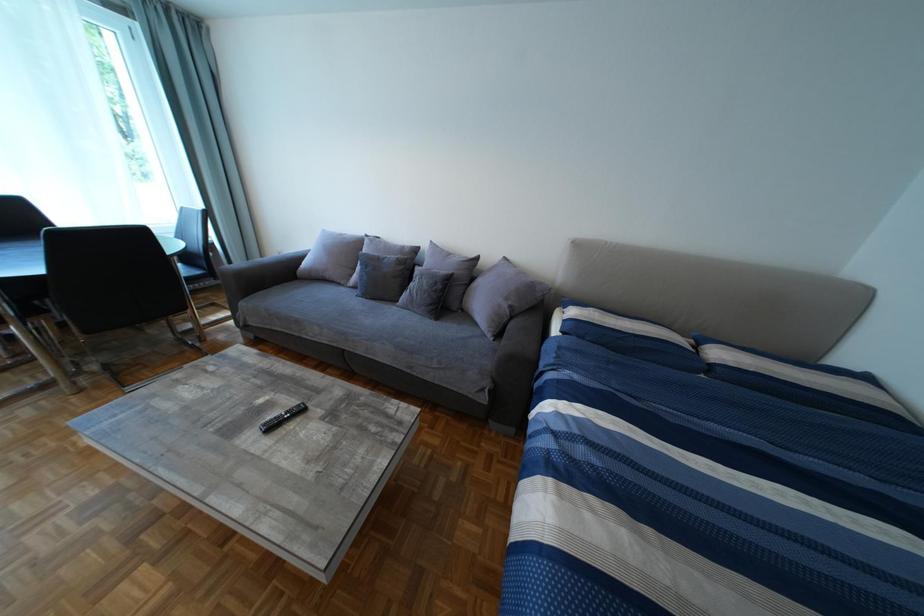
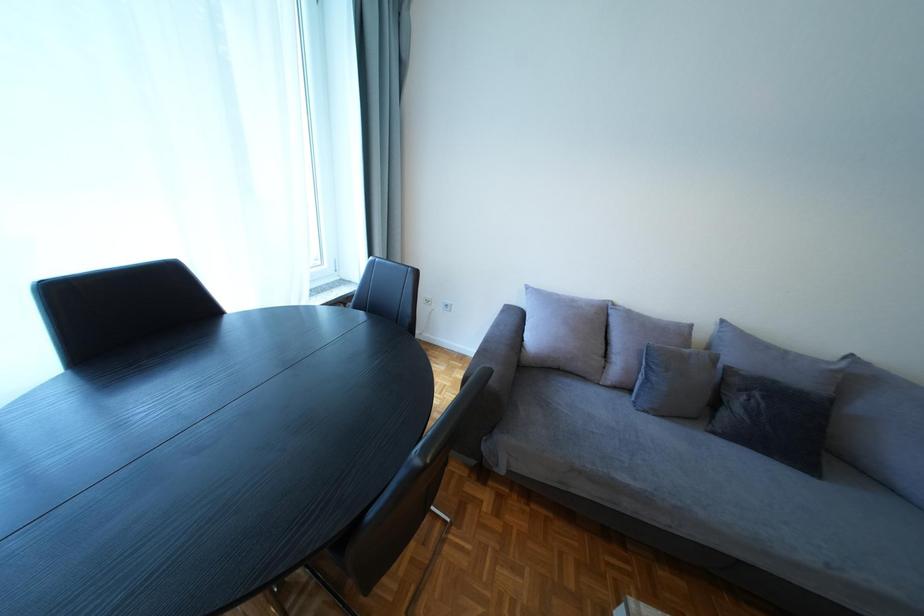
What movement of the cameraman would produce the second image?

The cameraman walked toward left, forward.